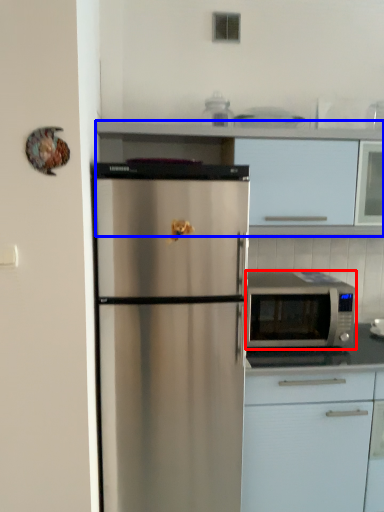
Question: Among these objects, which one is farthest to the camera, microwave oven (highlighted by a red box) or cabinetry (highlighted by a blue box)?

Choices:
 (A) microwave oven
 (B) cabinetry

Answer: (A)